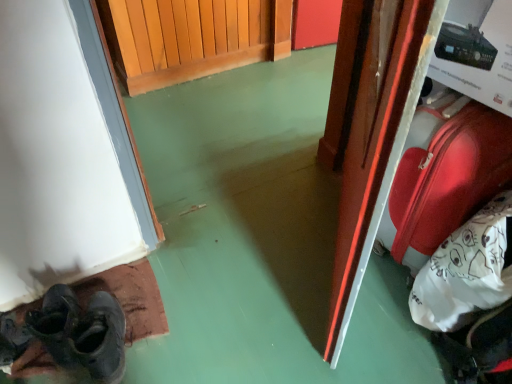
Question: Is glossy wood door at right closer to the viewer compared to dark gray leather shoe at lower left?

Choices:
 (A) yes
 (B) no

Answer: (A)

Question: Considering the relative sizes of glossy wood door at right and dark gray leather shoe at lower left in the image provided, is glossy wood door at right taller than dark gray leather shoe at lower left?

Choices:
 (A) no
 (B) yes

Answer: (B)

Question: From the image's perspective, is glossy wood door at right under dark gray leather shoe at lower left?

Choices:
 (A) no
 (B) yes

Answer: (A)

Question: Is glossy wood door at right completely or partially outside of dark gray leather shoe at lower left?

Choices:
 (A) no
 (B) yes

Answer: (B)

Question: Considering the relative sizes of glossy wood door at right and dark gray leather shoe at lower left in the image provided, is glossy wood door at right thinner than dark gray leather shoe at lower left?

Choices:
 (A) no
 (B) yes

Answer: (B)

Question: From a real-world perspective, is dark gray leather shoes at lower left positioned above or below dark gray leather shoe at lower left?

Choices:
 (A) below
 (B) above

Answer: (B)

Question: Is dark gray leather shoes at lower left in front of or behind dark gray leather shoe at lower left in the image?

Choices:
 (A) behind
 (B) front

Answer: (A)

Question: From the image's perspective, is dark gray leather shoes at lower left positioned above or below dark gray leather shoe at lower left?

Choices:
 (A) above
 (B) below

Answer: (A)

Question: Considering the positions of point (57, 347) and point (103, 292), is point (57, 347) closer or farther from the camera than point (103, 292)?

Choices:
 (A) farther
 (B) closer

Answer: (B)

Question: Based on their sizes in the image, would you say dark gray leather shoes at lower left is bigger or smaller than shiny red suitcase at right?

Choices:
 (A) small
 (B) big

Answer: (A)

Question: Visually, is dark gray leather shoes at lower left positioned to the left or to the right of shiny red suitcase at right?

Choices:
 (A) right
 (B) left

Answer: (B)

Question: From a real-world perspective, is dark gray leather shoes at lower left physically located above or below shiny red suitcase at right?

Choices:
 (A) below
 (B) above

Answer: (A)

Question: From the image's perspective, is dark gray leather shoes at lower left positioned above or below shiny red suitcase at right?

Choices:
 (A) above
 (B) below

Answer: (B)

Question: Considering the positions of shiny red suitcase at right and glossy wood door at right in the image, is shiny red suitcase at right wider or thinner than glossy wood door at right?

Choices:
 (A) thin
 (B) wide

Answer: (B)

Question: Based on their positions, is shiny red suitcase at right located to the left or right of glossy wood door at right?

Choices:
 (A) left
 (B) right

Answer: (B)